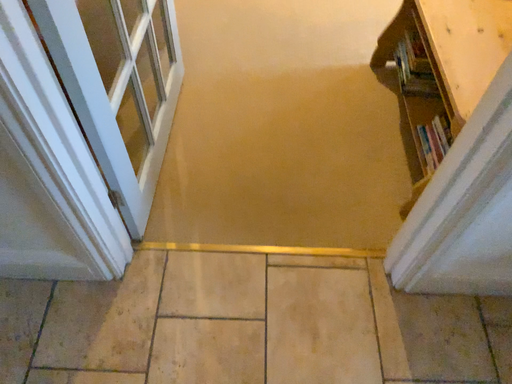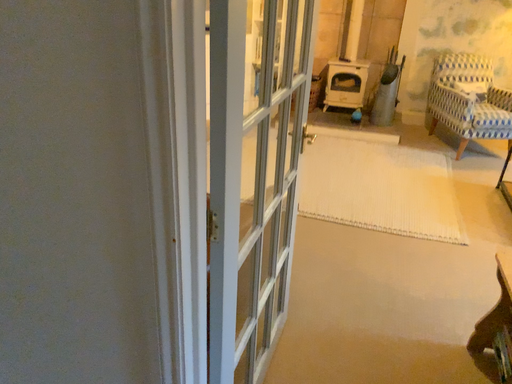
Question: How did the camera likely rotate when shooting the video?

Choices:
 (A) rotated downward
 (B) rotated upward

Answer: (B)